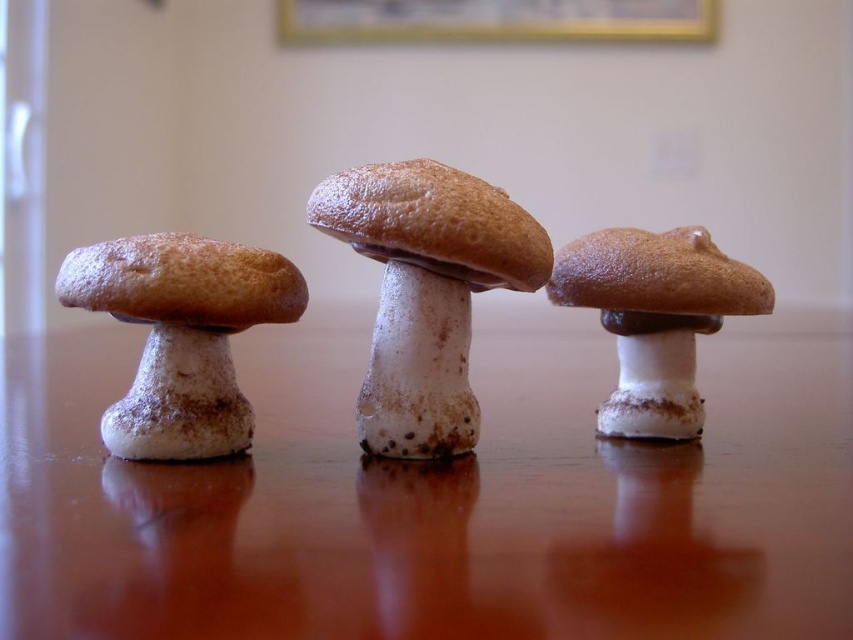
Between matte brown mushroom at left and gold-framed picture at upper center, which one is positioned higher?

gold-framed picture at upper center is above.

Find the location of `matte brown mushroom at left`. matte brown mushroom at left is located at coordinates (181, 336).

This screenshot has height=640, width=853. Describe the element at coordinates (181, 336) in the screenshot. I see `matte brown mushroom at left` at that location.

In order to click on matte brown mushroom at left in this screenshot , I will do tap(181, 336).

Who is higher up, brown matte table at center or matte brown mushroom at left?

brown matte table at center

Is brown matte table at center below matte brown mushroom at left?

Incorrect, brown matte table at center is not positioned below matte brown mushroom at left.

Is point (495, 346) more distant than point (201, 358)?

Yes, it is behind point (201, 358).

Locate an element on the screen. The width and height of the screenshot is (853, 640). brown matte table at center is located at coordinates (437, 497).

Based on the photo, which is below, spongy white mushroom at center or brown matte mushroom at center?

brown matte mushroom at center

Is point (440, 221) farther from viewer compared to point (635, 346)?

No, it is not.

Where is `spongy white mushroom at center`? spongy white mushroom at center is located at coordinates (426, 291).